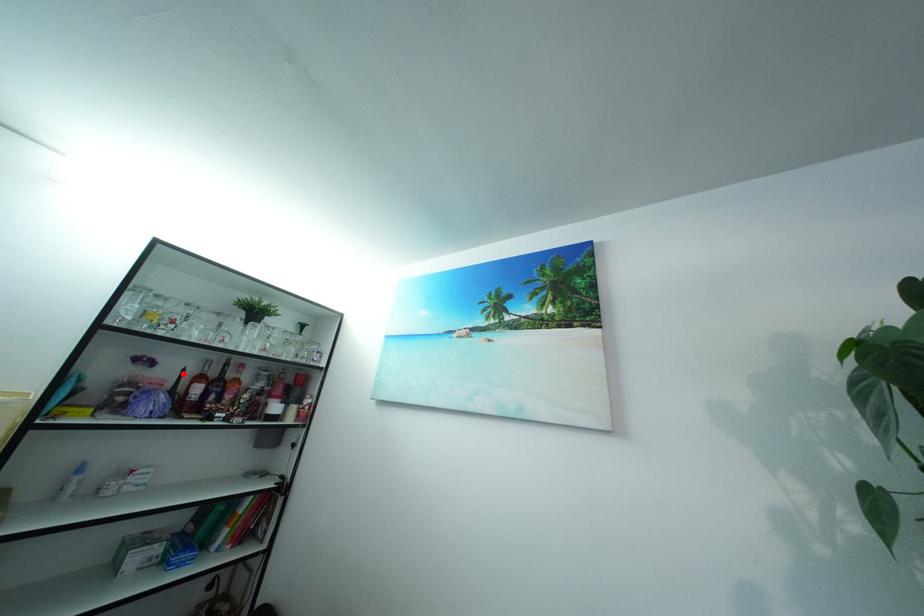
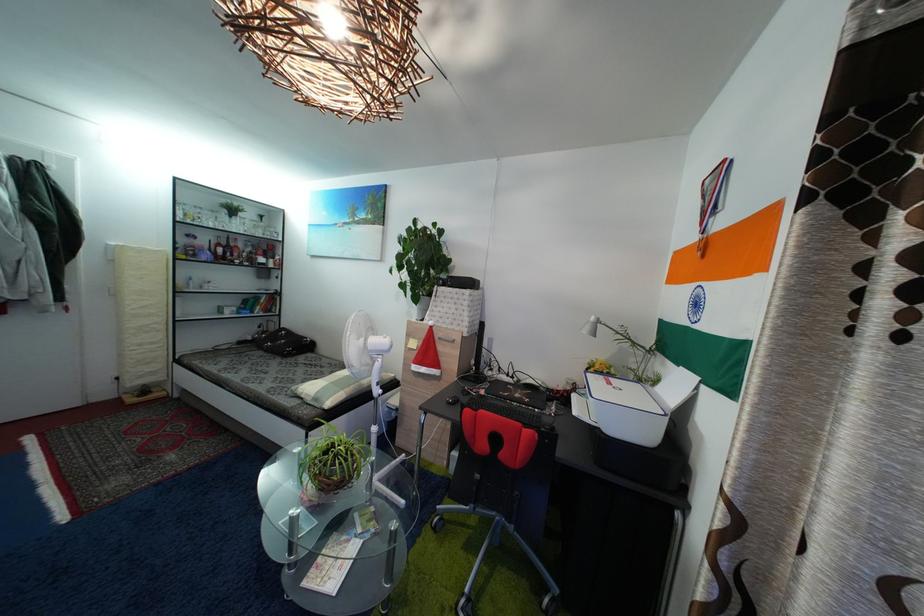
The point at the highlighted location is marked in the first image. Where is the corresponding point in the second image?

(213, 246)